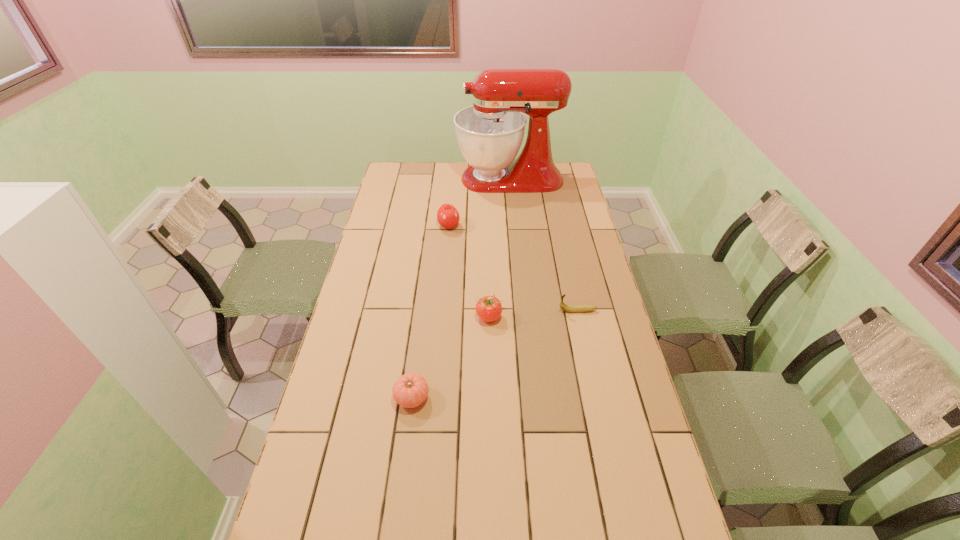
Identify the location of object situated at the far right corner. (490, 133).

The width and height of the screenshot is (960, 540). In the image, there is a desktop. Find the location of `vacant area at the left edge`. vacant area at the left edge is located at coordinates (412, 202).

Find the location of a particular element. vacant space at the right edge of the desktop is located at coordinates (618, 417).

Identify the location of free space at the far right corner of the desktop. The image size is (960, 540). (557, 168).

Identify the location of free space between the banana and the left tomato. Image resolution: width=960 pixels, height=540 pixels. (494, 354).

Find the location of `free space that is in between the farthest object and the right tomato`. free space that is in between the farthest object and the right tomato is located at coordinates (499, 248).

Image resolution: width=960 pixels, height=540 pixels. Identify the location of free point between the left tomato and the banana. (494, 354).

Locate an element on the screen. This screenshot has width=960, height=540. free space that is in between the mixer and the fourth shortest object is located at coordinates (479, 202).

This screenshot has width=960, height=540. I want to click on unoccupied area between the banana and the nearer tomato, so click(494, 354).

Find the location of `vacant space that is in between the banana and the tallest object`. vacant space that is in between the banana and the tallest object is located at coordinates (543, 245).